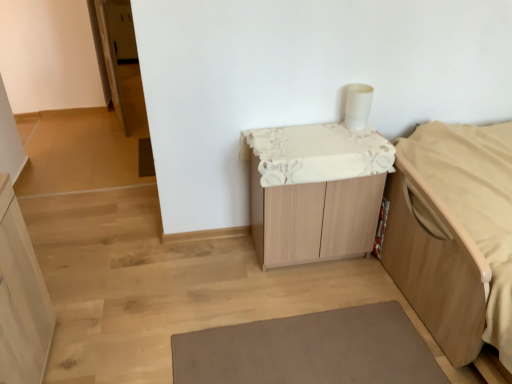
This screenshot has height=384, width=512. Identify the location of vacant space in gray matte bath mat at lower center (from a real-world perspective). (312, 351).